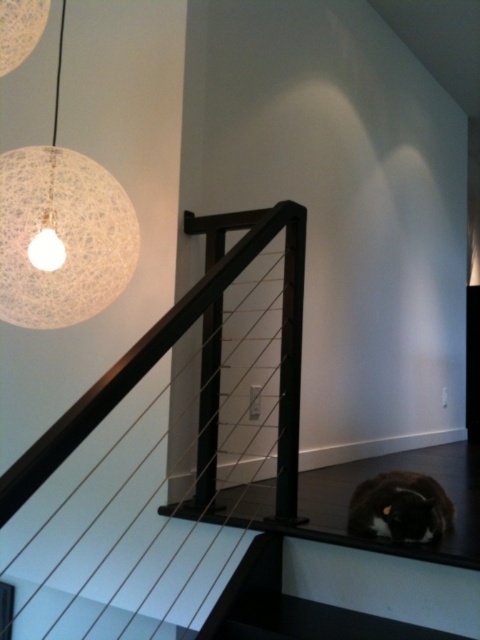
You are standing at the bottom of the staircase and see the point marked at coordinates [167,454]. Which object is this point located on?

The point marked at coordinates [167,454] is located on the black matte rail at upper left.

You are standing at the bottom of the staircase and want to hang a new picture frame between the black matte rail at upper left and the white textured sphere at upper left. Based on their positions, which object should the frame be placed closer to?

The frame should be placed closer to the white textured sphere at upper left because the black matte rail at upper left is positioned under it, meaning the sphere is higher up and the frame can be placed between them by aligning it above the rail but below the sphere.